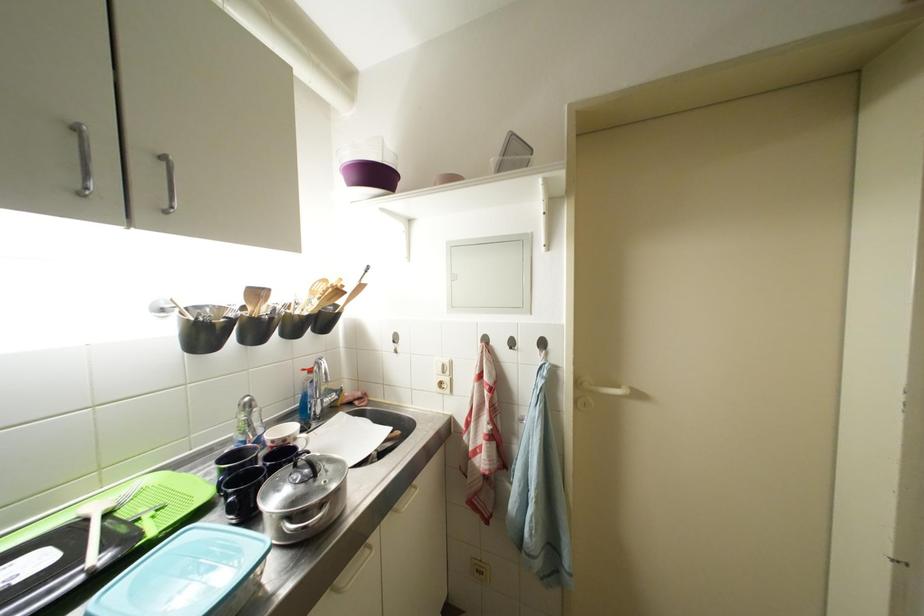
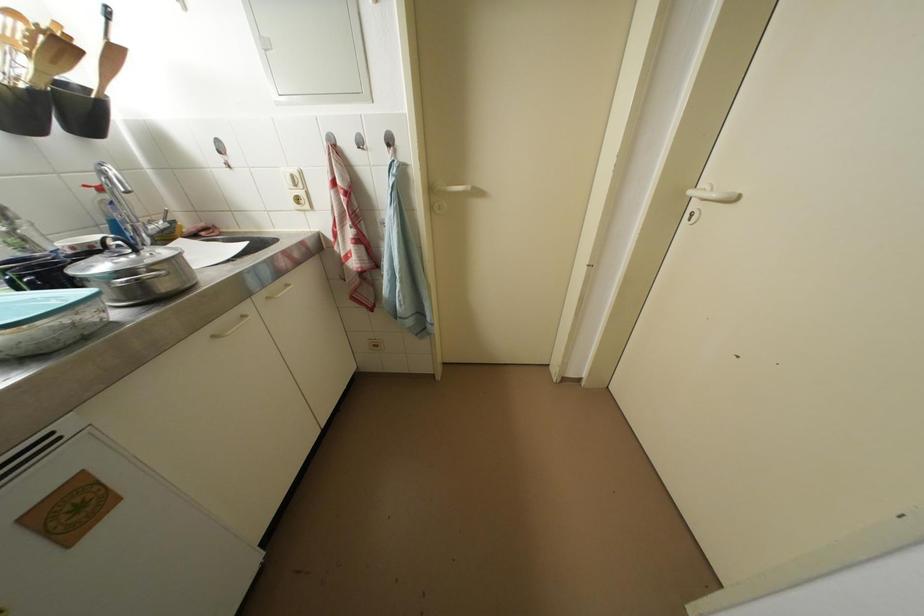
Find the pixel in the second image that matches the point at 345,296 in the first image.

(69, 50)